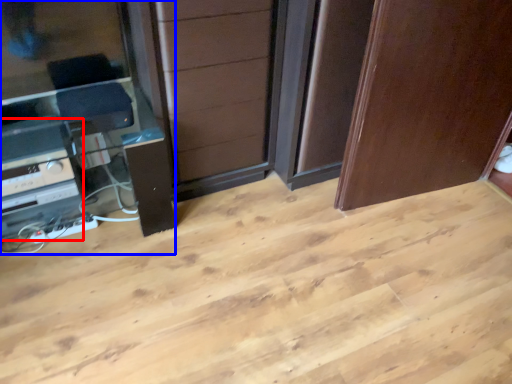
Question: Among these objects, which one is farthest to the camera, appliance (highlighted by a red box) or entertainment center (highlighted by a blue box)?

Choices:
 (A) appliance
 (B) entertainment center

Answer: (A)